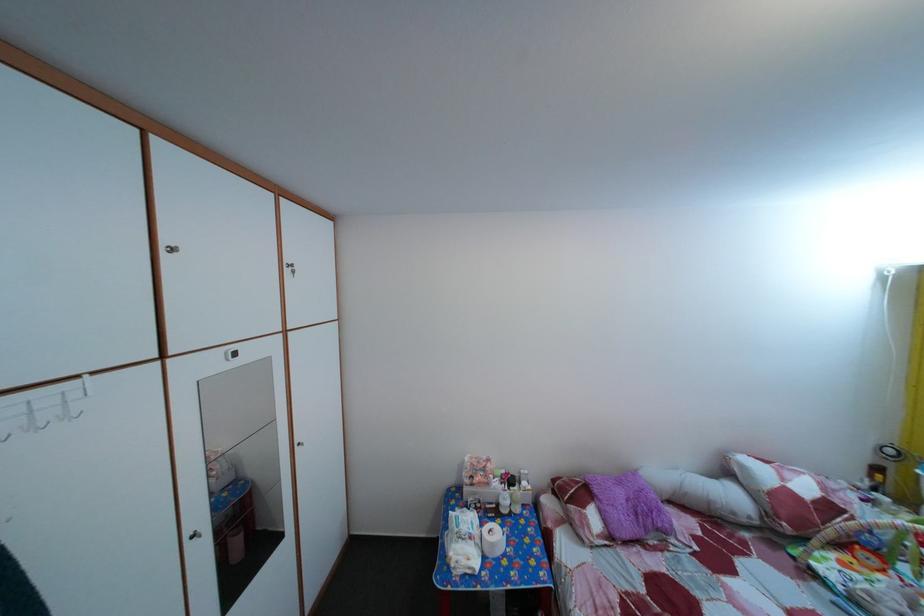
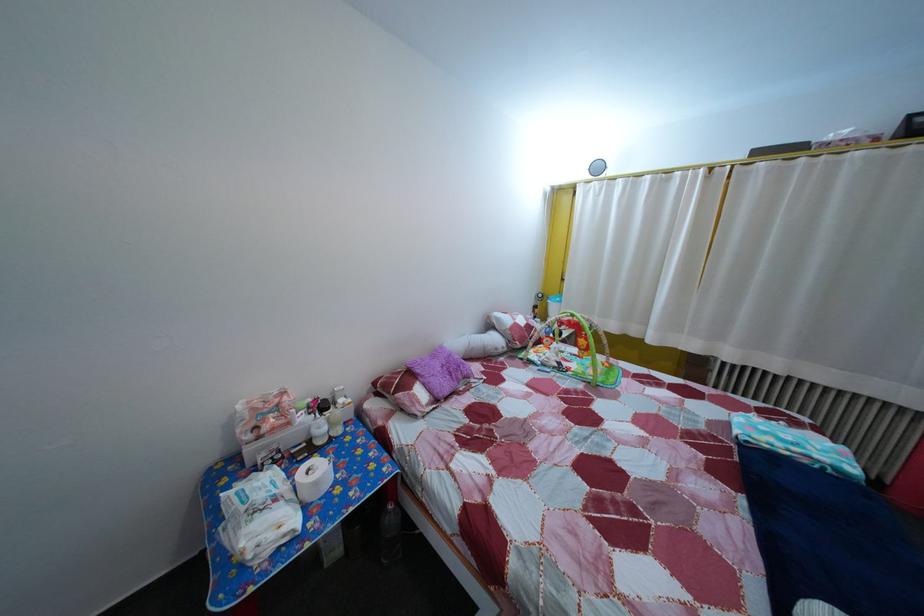
Where in the second image is the point corresponding to point (480, 546) from the first image?

(285, 508)